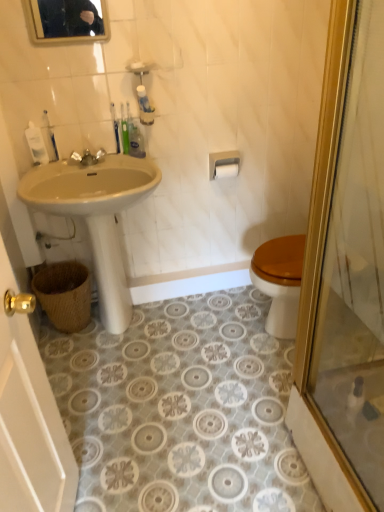
Identify the location of vacant area in front of white plastic toothpaste tube at upper left, which is the 2th toiletry from right to left. The height and width of the screenshot is (512, 384). (43, 172).